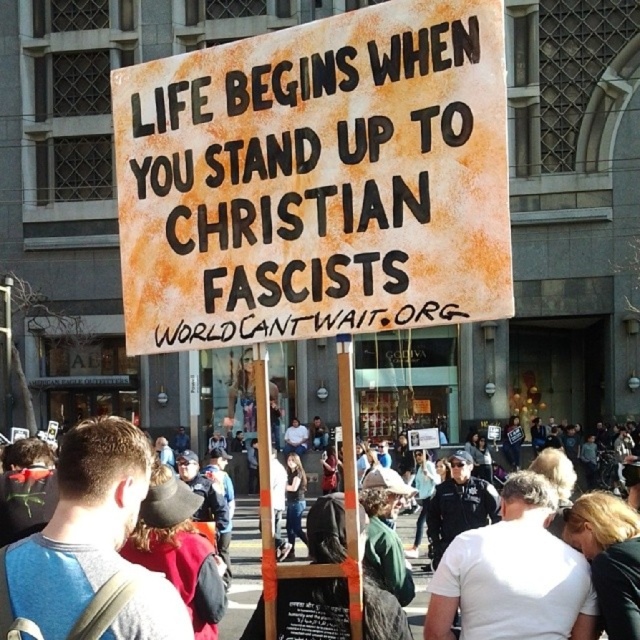
Between point (387, 88) and point (40, 593), which one is positioned behind?

Point (387, 88)

Does rusty cardboard sign at center appear under white cotton shirt at center?

No.

Where is `rusty cardboard sign at center`? Image resolution: width=640 pixels, height=640 pixels. rusty cardboard sign at center is located at coordinates (316, 179).